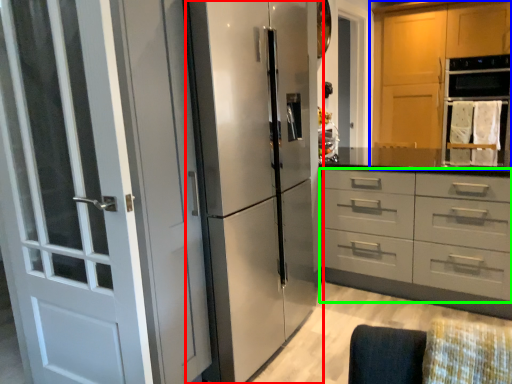
Question: Considering the real-world distances, which object is farthest from refrigerator (highlighted by a red box)? cabinetry (highlighted by a blue box) or drawer (highlighted by a green box)?

Choices:
 (A) cabinetry
 (B) drawer

Answer: (A)